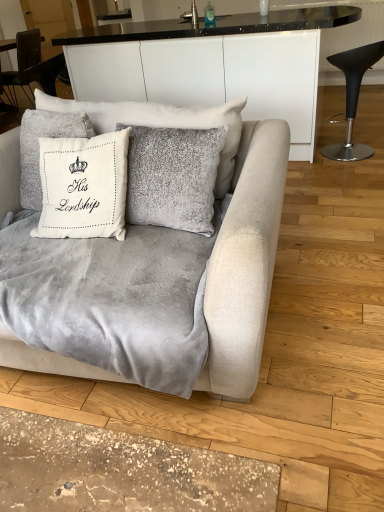
Question: Is the depth of white velvet cushion at upper center, which ranks as the second pillow in right-to-left order, less than that of black leather stool at right?

Choices:
 (A) no
 (B) yes

Answer: (B)

Question: Can you confirm if white velvet cushion at upper center, arranged as the first pillow when viewed from the left, is wider than black leather stool at right?

Choices:
 (A) no
 (B) yes

Answer: (A)

Question: Is white velvet cushion at upper center, which ranks as the second pillow in right-to-left order, smaller than black leather stool at right?

Choices:
 (A) no
 (B) yes

Answer: (B)

Question: Can you confirm if white velvet cushion at upper center, which ranks as the second pillow in right-to-left order, is thinner than black leather stool at right?

Choices:
 (A) no
 (B) yes

Answer: (B)

Question: Considering the relative sizes of white velvet cushion at upper center, arranged as the first pillow when viewed from the left, and black leather stool at right in the image provided, is white velvet cushion at upper center, arranged as the first pillow when viewed from the left, bigger than black leather stool at right?

Choices:
 (A) no
 (B) yes

Answer: (A)

Question: From the image's perspective, is white velvet cushion at upper center, arranged as the first pillow when viewed from the left, on black leather stool at right?

Choices:
 (A) yes
 (B) no

Answer: (B)

Question: Is velvet gray blanket at center to the right of black leather stool at right from the viewer's perspective?

Choices:
 (A) no
 (B) yes

Answer: (A)

Question: Is velvet gray blanket at center with black leather stool at right?

Choices:
 (A) yes
 (B) no

Answer: (B)

Question: From the image's perspective, does velvet gray blanket at center appear higher than black leather stool at right?

Choices:
 (A) yes
 (B) no

Answer: (B)

Question: Considering the relative sizes of velvet gray blanket at center and black leather stool at right in the image provided, is velvet gray blanket at center shorter than black leather stool at right?

Choices:
 (A) yes
 (B) no

Answer: (A)

Question: Can you confirm if velvet gray blanket at center is bigger than black leather stool at right?

Choices:
 (A) yes
 (B) no

Answer: (A)

Question: From a real-world perspective, does velvet gray blanket at center sit lower than black leather stool at right?

Choices:
 (A) yes
 (B) no

Answer: (A)

Question: From a real-world perspective, is velvet gray couch at center beneath black leather stool at right?

Choices:
 (A) yes
 (B) no

Answer: (B)